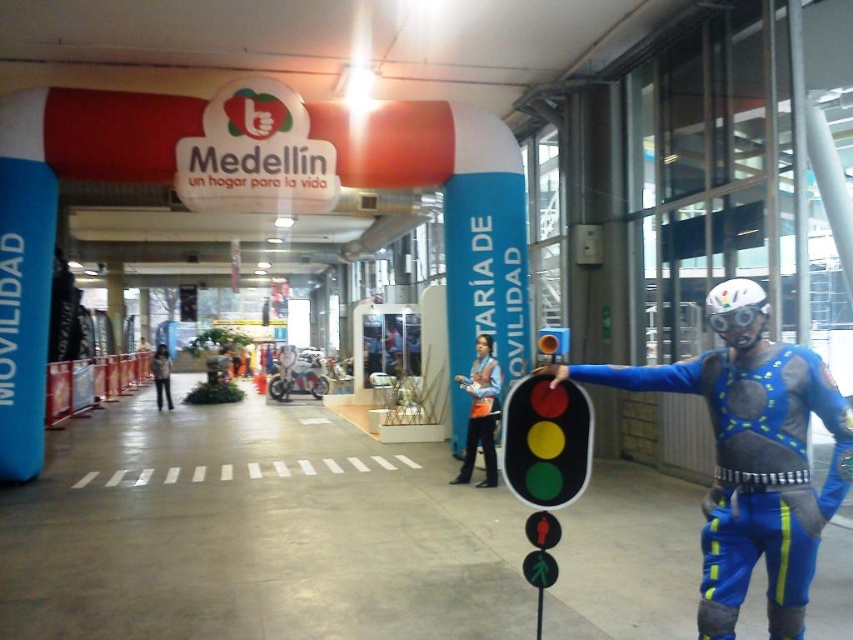
Does blue fabric costume at center come in front of orange safety vest at center?

Yes, blue fabric costume at center is closer to the viewer.

Can you confirm if blue fabric costume at center is positioned to the left of orange safety vest at center?

No, blue fabric costume at center is not to the left of orange safety vest at center.

Identify the location of blue fabric costume at center. This screenshot has width=853, height=640. (751, 456).

Between orange safety vest at center and denim jacket at center, which one is positioned higher?

Positioned higher is orange safety vest at center.

Is the position of orange safety vest at center more distant than that of denim jacket at center?

No, orange safety vest at center is closer to the viewer.

Where is `orange safety vest at center`? This screenshot has height=640, width=853. orange safety vest at center is located at coordinates (480, 412).

Locate an element on the screen. Image resolution: width=853 pixels, height=640 pixels. orange safety vest at center is located at coordinates (480, 412).

Is blue fabric costume at center above denim jacket at center?

Yes, blue fabric costume at center is above denim jacket at center.

Does blue fabric costume at center have a larger size compared to denim jacket at center?

Actually, blue fabric costume at center might be smaller than denim jacket at center.

Does point (840, 480) lie behind point (166, 348)?

No, (840, 480) is in front of (166, 348).

You are a GUI agent. You are given a task and a screenshot of the screen. Output one action in this format:
    pyautogui.click(x=<x>, y=<y>)
    Task: Click on the blue fabric costume at center
    Image resolution: width=853 pixels, height=640 pixels.
    Given the screenshot: What is the action you would take?
    pyautogui.click(x=751, y=456)